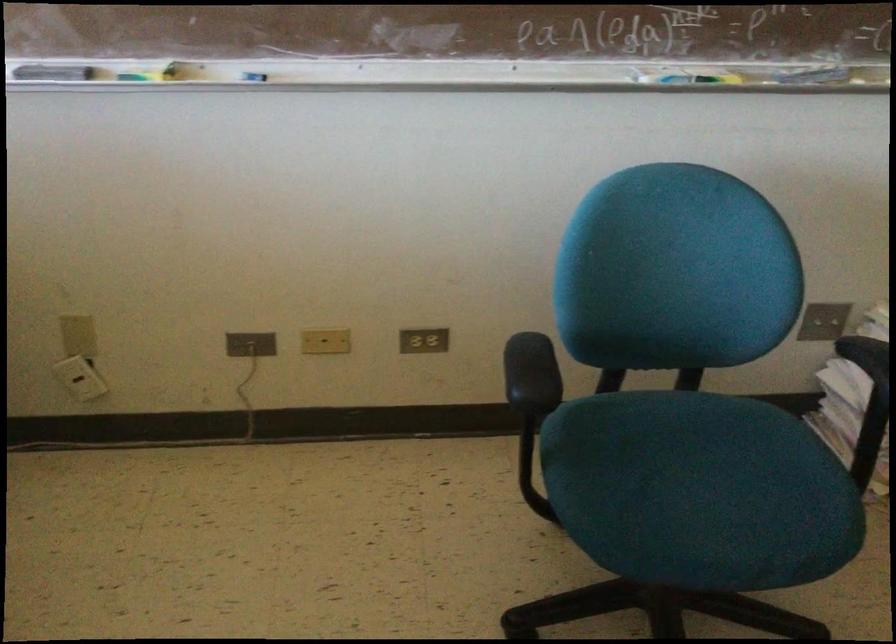
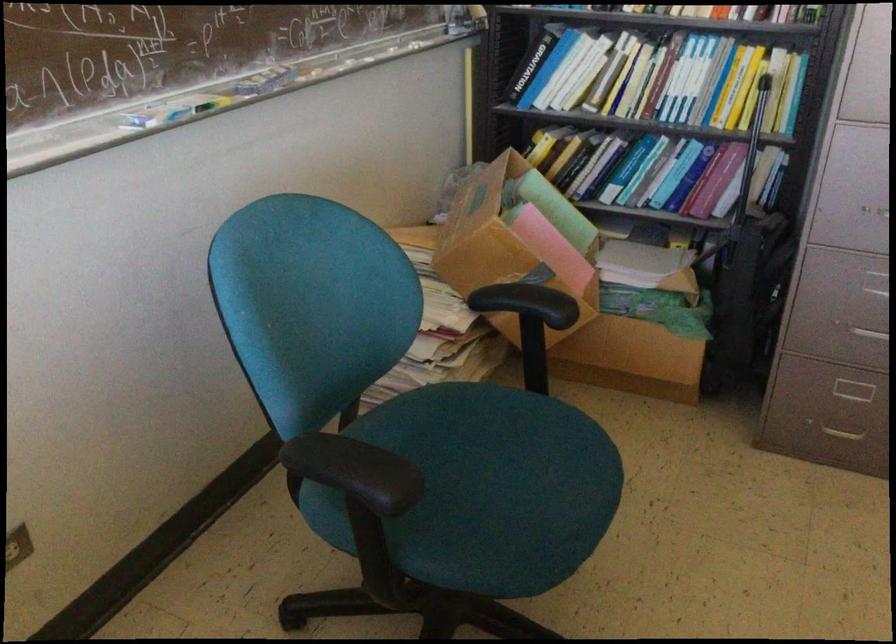
Question: I am providing you with two images of the same scene from different viewpoints. After the viewpoint changes to image2, which objects are now occluded?

Choices:
 (A) dark basket lid
 (B) black chair armrest
 (C) electrical outlet
 (D) blue chair sitting surface

Answer: (C)